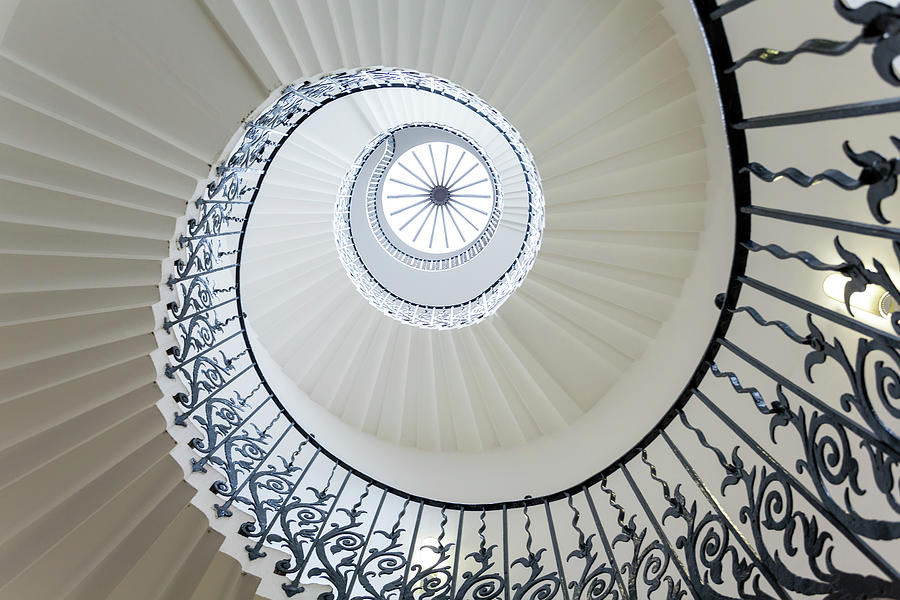
You are a GUI agent. You are given a task and a screenshot of the screen. Output one action in this format:
    pyautogui.click(x=<x>, y=<y>)
    Task: Click on the black spiral hand rail
    This screenshot has height=600, width=900.
    Given the screenshot: What is the action you would take?
    pyautogui.click(x=735, y=155), pyautogui.click(x=444, y=508), pyautogui.click(x=240, y=248), pyautogui.click(x=330, y=102), pyautogui.click(x=482, y=114), pyautogui.click(x=351, y=198), pyautogui.click(x=378, y=188)